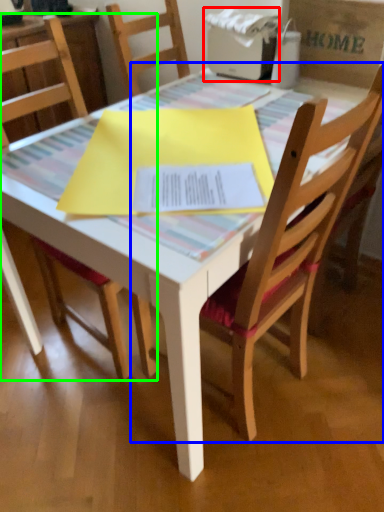
Question: Which is farther away from printer (highlighted by a red box)? chair (highlighted by a blue box) or chair (highlighted by a green box)?

Choices:
 (A) chair
 (B) chair

Answer: (B)